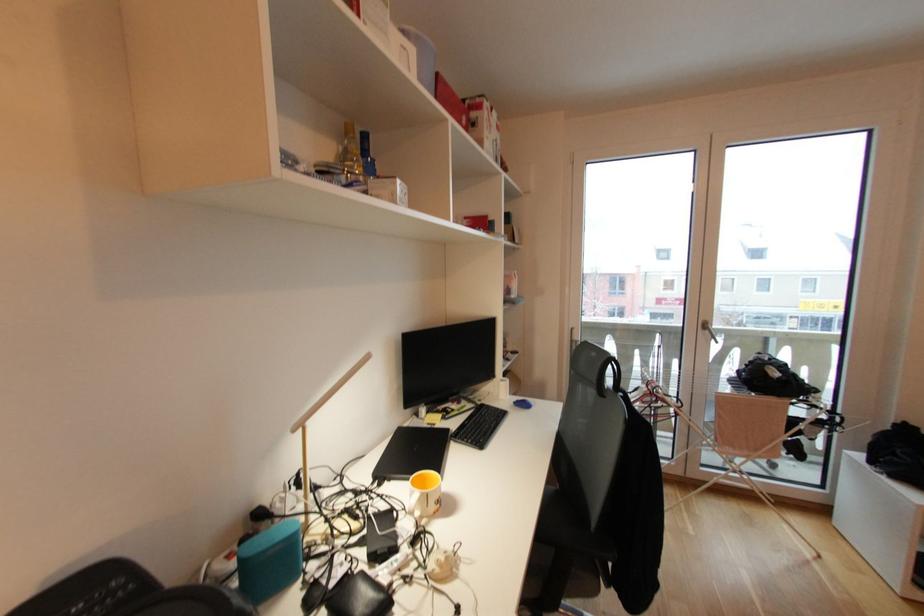
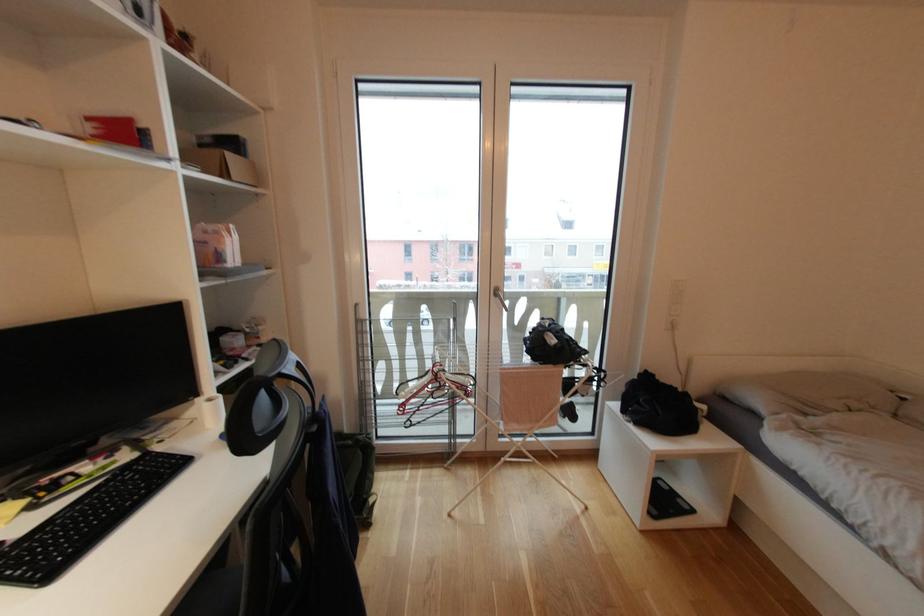
Which direction would the cameraman need to move to produce the second image?

The cameraman walked toward right, forward.